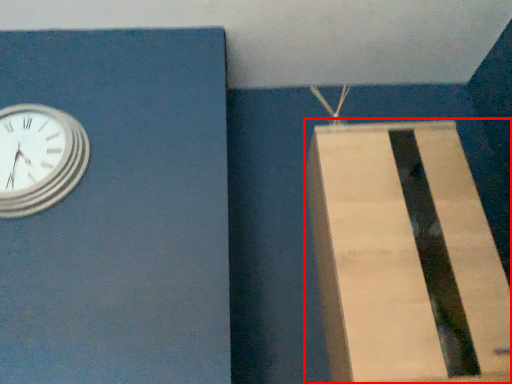
Question: In this image, where is cardboard box (annotated by the red box) located relative to wall clock?

Choices:
 (A) left
 (B) right

Answer: (B)